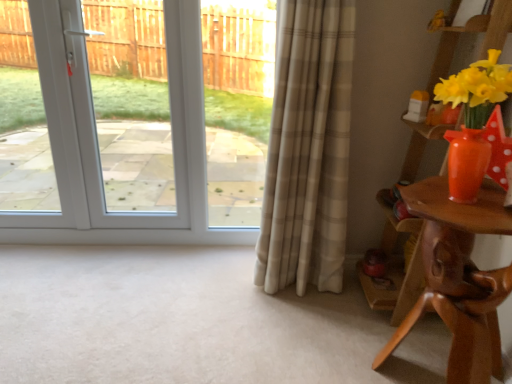
Question: From a real-world perspective, is white glossy door at upper left positioned under matte orange vase at right based on gravity?

Choices:
 (A) no
 (B) yes

Answer: (B)

Question: Considering the relative sizes of white glossy door at upper left and matte orange vase at right in the image provided, is white glossy door at upper left thinner than matte orange vase at right?

Choices:
 (A) no
 (B) yes

Answer: (B)

Question: Does white glossy door at upper left have a greater width compared to matte orange vase at right?

Choices:
 (A) no
 (B) yes

Answer: (A)

Question: From the image's perspective, is white glossy door at upper left located beneath matte orange vase at right?

Choices:
 (A) yes
 (B) no

Answer: (B)

Question: Is white glossy door at upper left looking in the opposite direction of matte orange vase at right?

Choices:
 (A) no
 (B) yes

Answer: (A)

Question: Is point (450, 165) closer or farther from the camera than point (195, 208)?

Choices:
 (A) closer
 (B) farther

Answer: (A)

Question: From a real-world perspective, is matte orange vase at right above or below white glossy door at upper left?

Choices:
 (A) above
 (B) below

Answer: (A)

Question: Looking at their shapes, would you say matte orange vase at right is wider or thinner than white glossy door at upper left?

Choices:
 (A) thin
 (B) wide

Answer: (B)

Question: Considering the positions of matte orange vase at right and white glossy door at upper left in the image, is matte orange vase at right taller or shorter than white glossy door at upper left?

Choices:
 (A) short
 (B) tall

Answer: (A)

Question: Is brown wooden table at right situated inside beige plaid curtain at center or outside?

Choices:
 (A) outside
 (B) inside

Answer: (A)

Question: Does point (492, 187) appear closer or farther from the camera than point (294, 21)?

Choices:
 (A) closer
 (B) farther

Answer: (A)

Question: Visually, is brown wooden table at right positioned to the left or to the right of beige plaid curtain at center?

Choices:
 (A) left
 (B) right

Answer: (B)

Question: From a real-world perspective, is brown wooden table at right positioned above or below beige plaid curtain at center?

Choices:
 (A) above
 (B) below

Answer: (B)

Question: From the image's perspective, is brown wooden table at right positioned above or below matte orange vase at right?

Choices:
 (A) below
 (B) above

Answer: (A)

Question: Is brown wooden table at right in front of or behind matte orange vase at right in the image?

Choices:
 (A) behind
 (B) front

Answer: (A)